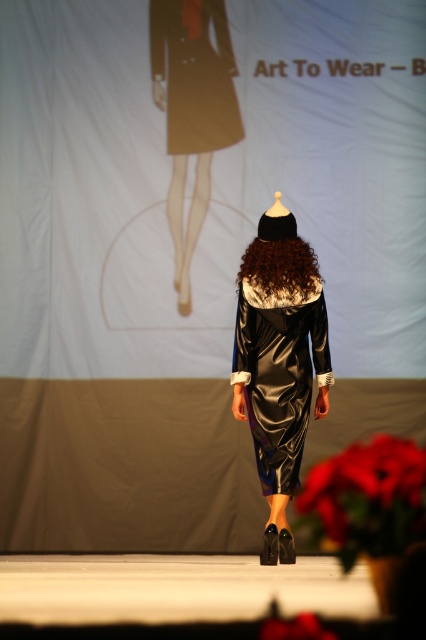
Describe the element at coordinates (279, 374) in the screenshot. This screenshot has width=426, height=640. I see `satin dress at center` at that location.

Who is higher up, satin dress at center or brown fuzzy coat at upper center?

brown fuzzy coat at upper center

Where is `satin dress at center`? The height and width of the screenshot is (640, 426). satin dress at center is located at coordinates click(279, 374).

From the picture: Between brown fuzzy coat at upper center and brown furry wig at center, which one has less height?

With less height is brown furry wig at center.

Can you confirm if brown fuzzy coat at upper center is bigger than brown furry wig at center?

Yes.

Is point (236, 132) closer to camera compared to point (304, 273)?

That is False.

The width and height of the screenshot is (426, 640). In order to click on brown fuzzy coat at upper center in this screenshot , I will do `click(195, 74)`.

Who is shorter, matte brown skirt at upper center or brown fuzzy coat at upper center?

brown fuzzy coat at upper center

Does matte brown skirt at upper center have a larger size compared to brown fuzzy coat at upper center?

Yes, matte brown skirt at upper center is bigger than brown fuzzy coat at upper center.

Is point (178, 20) positioned after point (207, 129)?

That is False.

Identify the location of matte brown skirt at upper center. (192, 109).